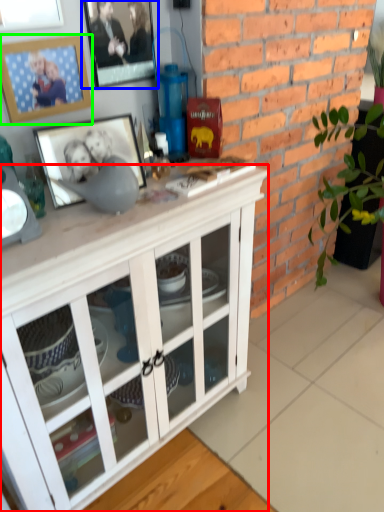
Question: Which object is positioned closest to cabinetry (highlighted by a red box)? Select from picture frame (highlighted by a blue box) and picture frame (highlighted by a green box).

Choices:
 (A) picture frame
 (B) picture frame

Answer: (B)